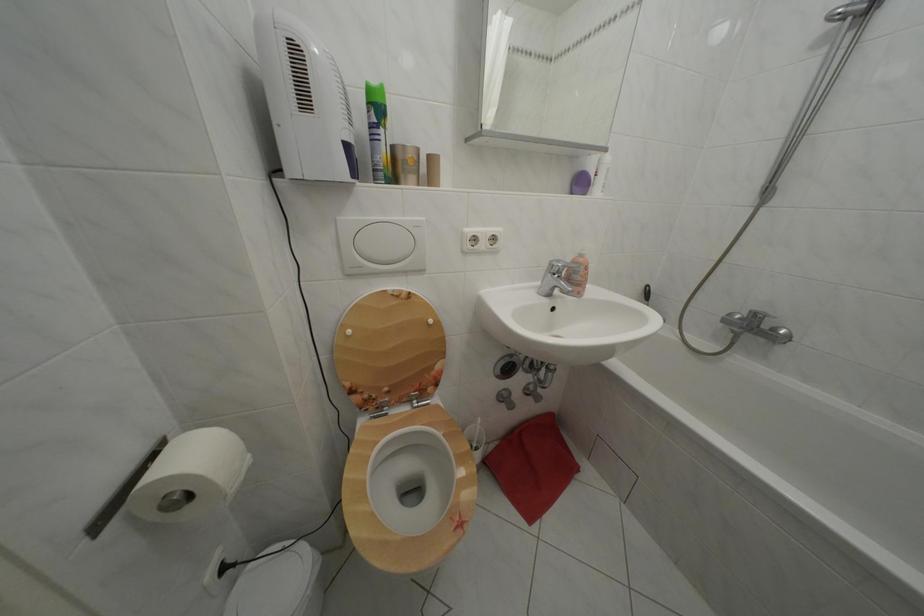
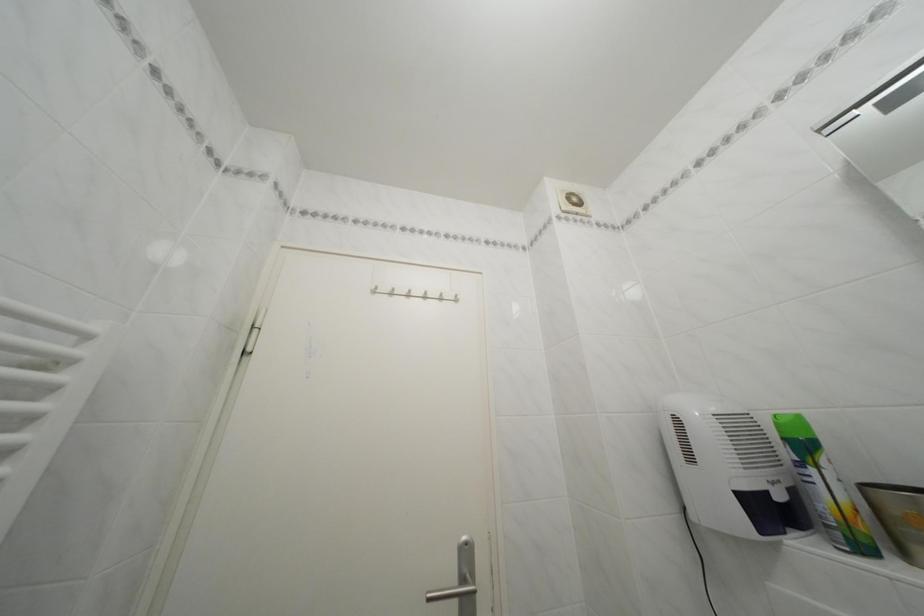
First-person continuous shooting, in which direction is the camera rotating?

The rotation direction of the camera is left-up.